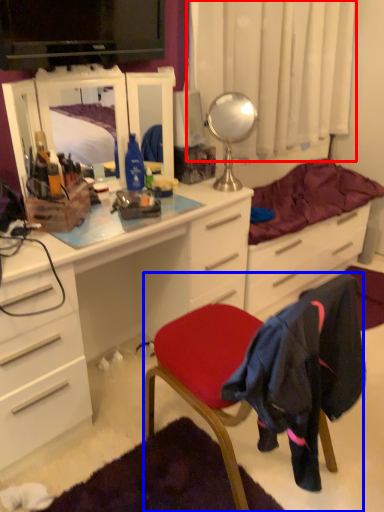
Question: Which object is closer to the camera taking this photo, curtain (highlighted by a red box) or chair (highlighted by a blue box)?

Choices:
 (A) curtain
 (B) chair

Answer: (B)